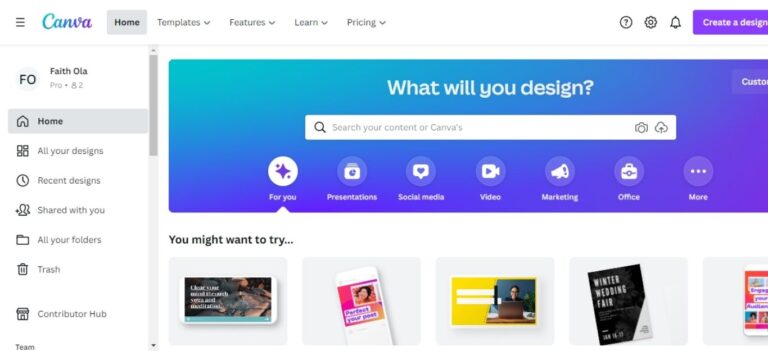
Where is `pictures`? This screenshot has width=768, height=351. pictures is located at coordinates (210, 310), (342, 305), (487, 300), (600, 310), (752, 312).